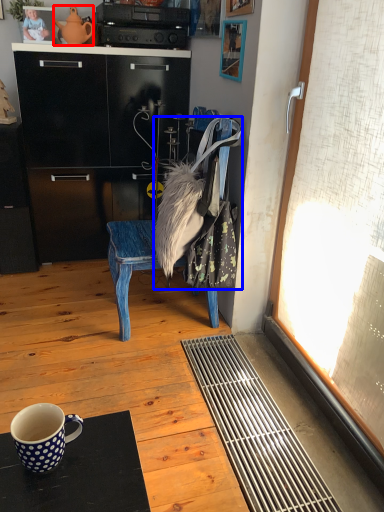
Question: Which of the following is the farthest to the observer, teapot (highlighted by a red box) or handbag (highlighted by a blue box)?

Choices:
 (A) teapot
 (B) handbag

Answer: (A)